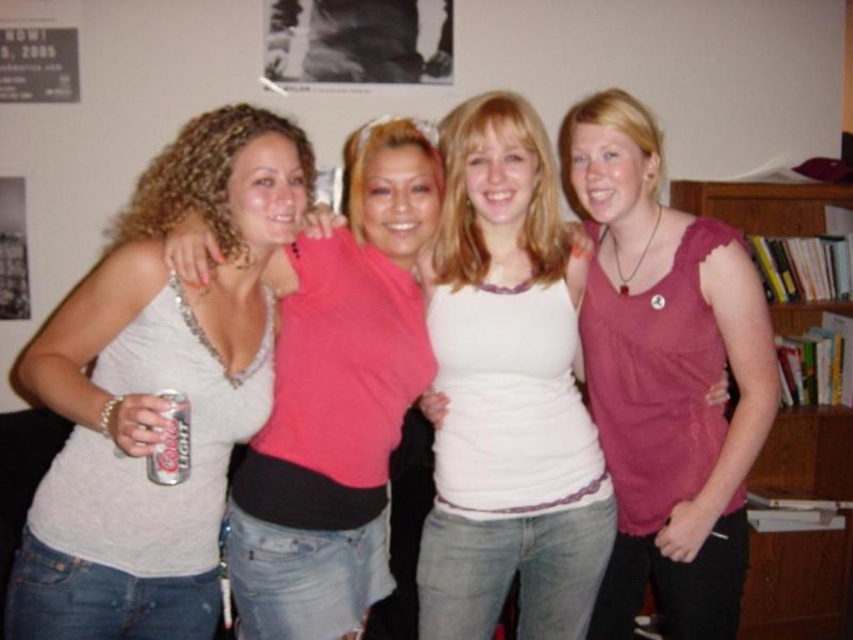
Question: Is pink fabric tank top at center below wooden bookshelf at right?

Choices:
 (A) no
 (B) yes

Answer: (A)

Question: Which of these objects is positioned closest to the white matte tank top at left?

Choices:
 (A) wooden bookshelf at right
 (B) silver metallic can at lower left
 (C) white matte tank top at center

Answer: (B)

Question: Which point appears closest to the camera in this image?

Choices:
 (A) (508, 541)
 (B) (631, 193)
 (C) (815, 624)
 (D) (113, 627)

Answer: (D)

Question: Is white matte tank top at left to the right of white matte tank top at center from the viewer's perspective?

Choices:
 (A) no
 (B) yes

Answer: (A)

Question: In this image, where is white matte tank top at center located relative to pink fabric tank top at center?

Choices:
 (A) left
 (B) right

Answer: (A)

Question: Among these points, which one is nearest to the camera?

Choices:
 (A) (663, 259)
 (B) (740, 636)
 (C) (178, 477)

Answer: (C)